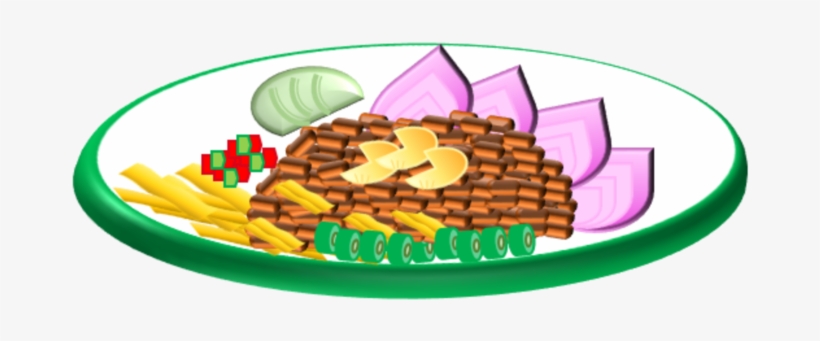
The image size is (820, 341). What are the coordinates of `1 plate` in the screenshot? It's located at (676, 159).